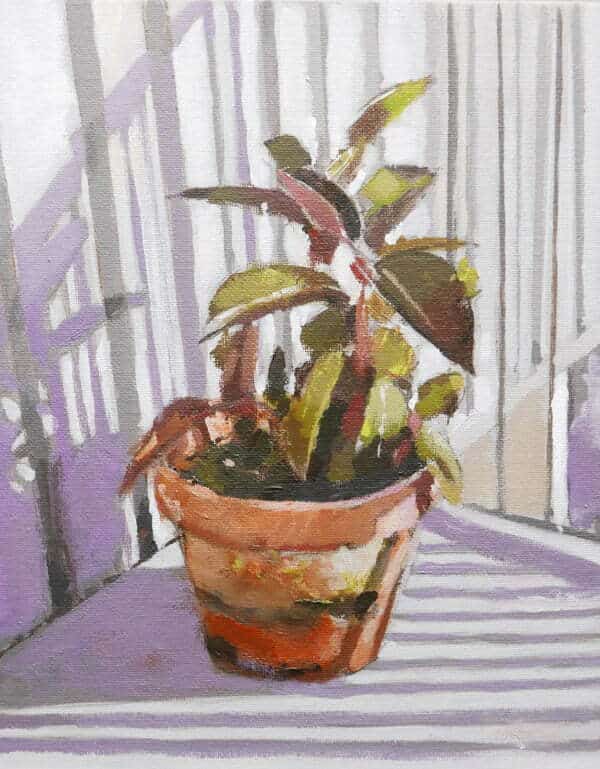
Image resolution: width=600 pixels, height=769 pixels. Identify the location of the top of pot of painted plant. (295, 513).